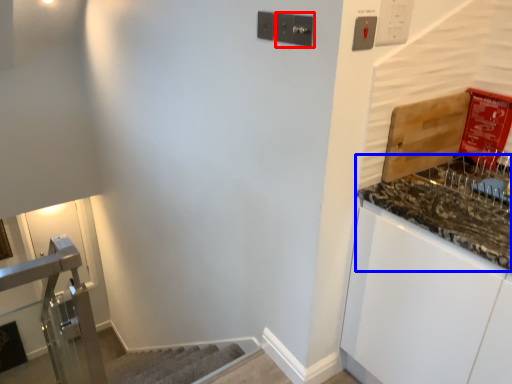
Question: Which of the following is the farthest to the observer, light switch (highlighted by a red box) or countertop (highlighted by a blue box)?

Choices:
 (A) light switch
 (B) countertop

Answer: (A)